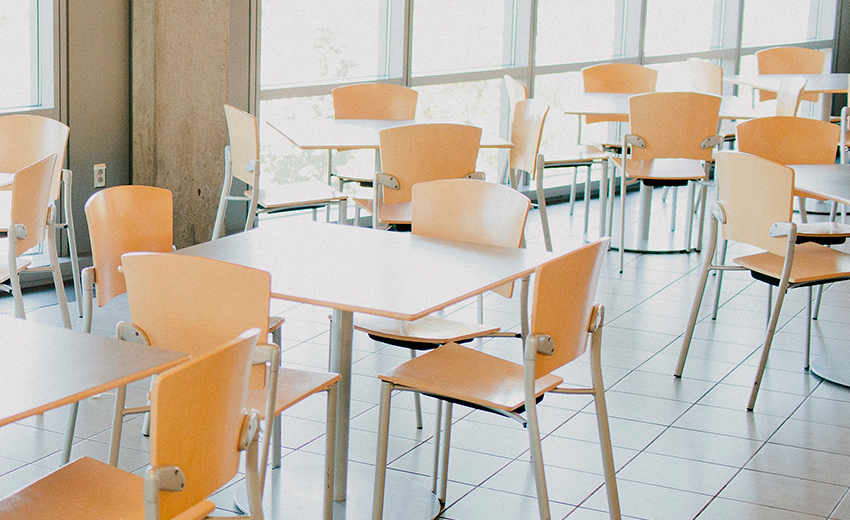
This screenshot has width=850, height=520. Find the location of `seats of the chairs`. seats of the chairs is located at coordinates (65, 497), (293, 379), (433, 374), (439, 338), (295, 191), (557, 149), (811, 257), (666, 167).